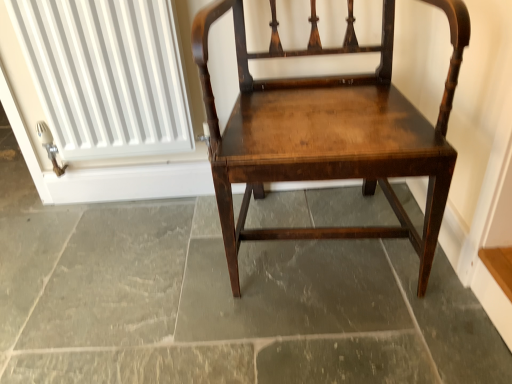
Identify the location of free space underneath white ribbed radiator at upper left (from a real-world perspective). This screenshot has height=384, width=512. (138, 195).